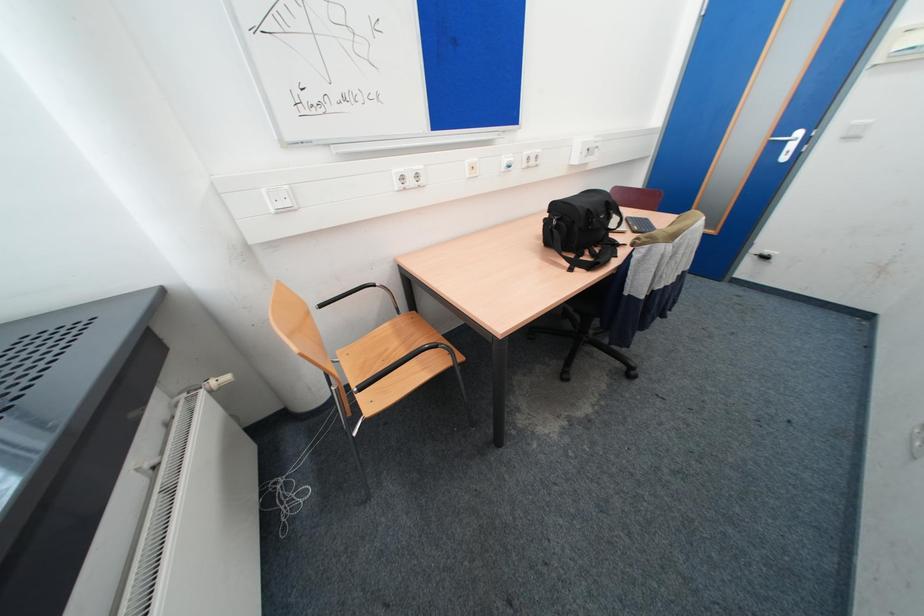
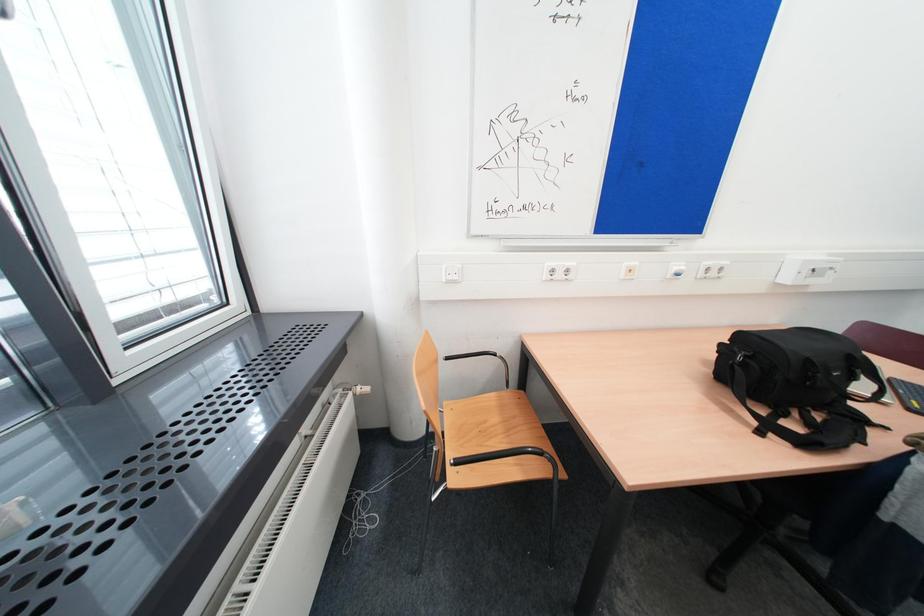
Question: The camera is either moving clockwise (left) or counter-clockwise (right) around the object. The first image is from the beginning of the video and the second image is from the end. Is the camera moving left or right when shooting the video?

Choices:
 (A) Left
 (B) Right

Answer: (B)